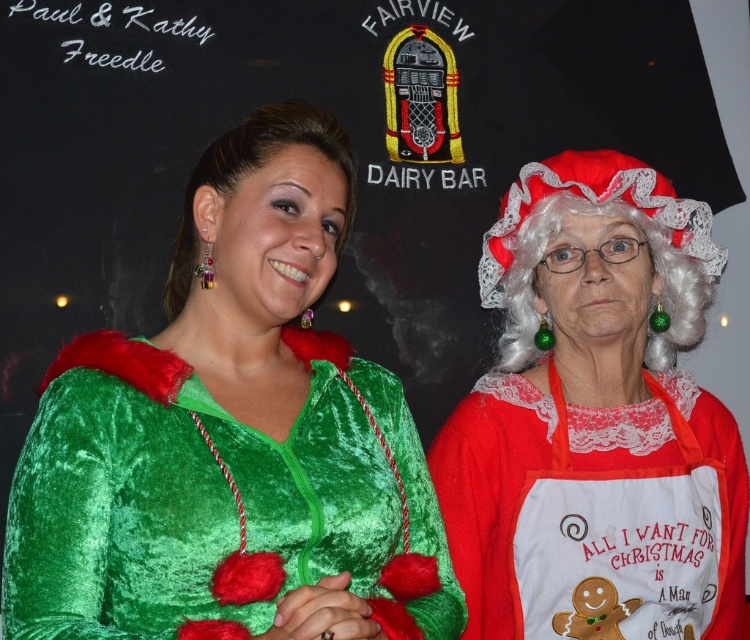
From the picture: Can you confirm if velvet red dress at right is positioned to the left of red velvet santa hat at upper right?

Yes, velvet red dress at right is to the left of red velvet santa hat at upper right.

Based on the photo, which is more to the right, velvet red dress at right or red velvet santa hat at upper right?

Positioned to the right is red velvet santa hat at upper right.

I want to click on velvet red dress at right, so click(596, 419).

This screenshot has width=750, height=640. What are the coordinates of `velvet red dress at right` in the screenshot? It's located at (596, 419).

Is velvet green dress at center thinner than red velvet santa hat at upper right?

In fact, velvet green dress at center might be wider than red velvet santa hat at upper right.

Is point (190, 273) behind point (588, 196)?

No, (190, 273) is in front of (588, 196).

This screenshot has width=750, height=640. I want to click on velvet green dress at center, so click(232, 436).

Between velvet green dress at center and velvet red dress at right, which one has less height?

velvet green dress at center is shorter.

Is velvet green dress at center to the right of velvet red dress at right from the viewer's perspective?

In fact, velvet green dress at center is to the left of velvet red dress at right.

Which is behind, point (198, 310) or point (579, 470)?

The point (579, 470) is behind.

This screenshot has height=640, width=750. I want to click on velvet green dress at center, so coord(232,436).